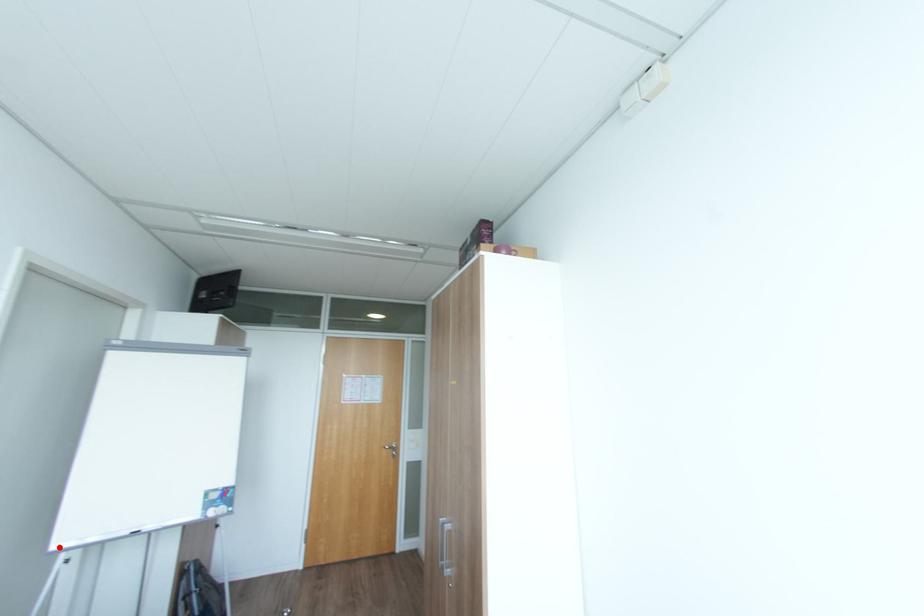
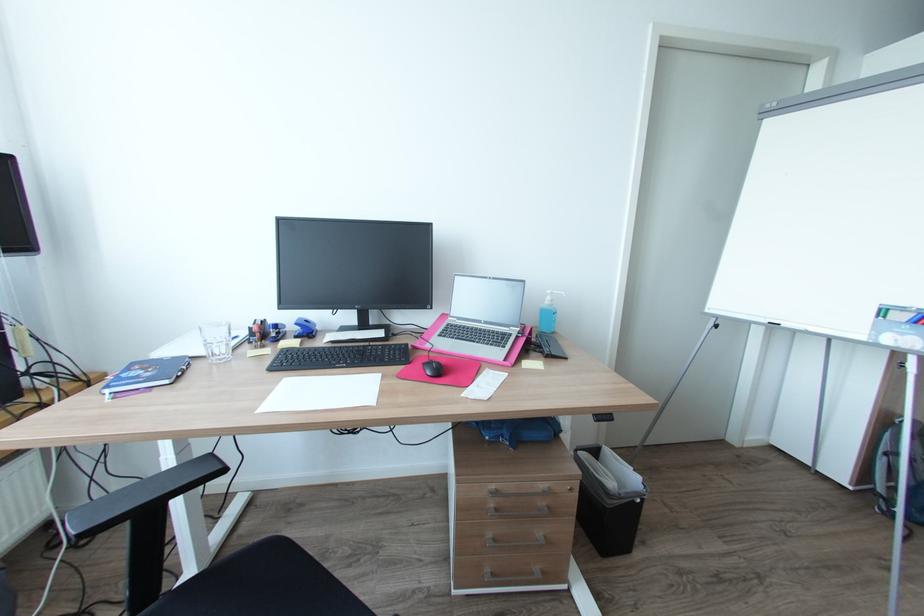
Where in the second image is the point corresponding to the highlighted location from the first image?

(712, 310)